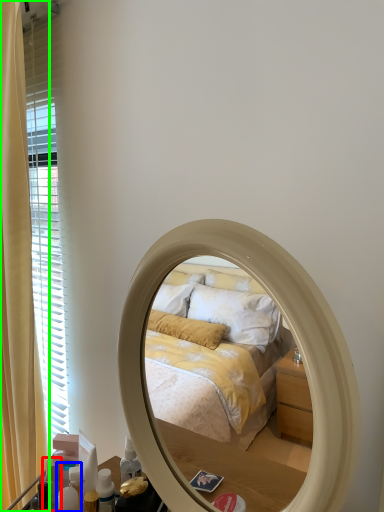
Question: Which object is the farthest from toiletry (highlighted by a red box)? Choose among these: toiletry (highlighted by a blue box) or curtain (highlighted by a green box).

Choices:
 (A) toiletry
 (B) curtain

Answer: (B)